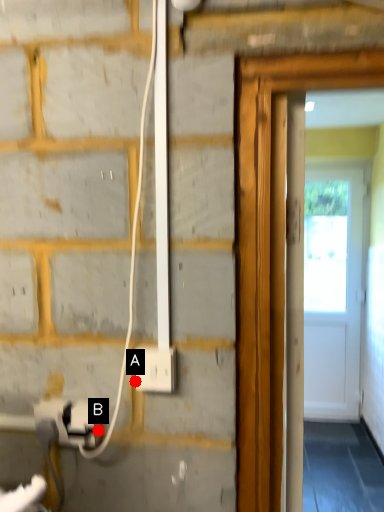
Question: Two points are circled on the image, labeled by A and B beside each circle. Which point appears farthest from the camera in this image?

Choices:
 (A) A is further
 (B) B is further

Answer: (B)